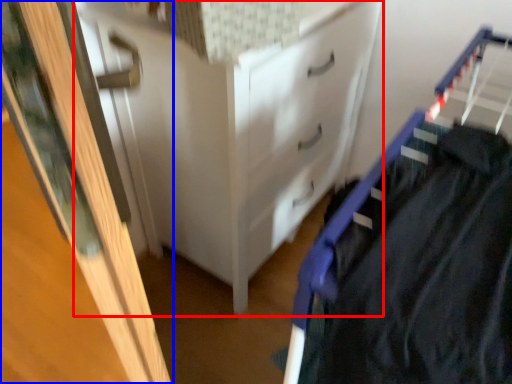
Question: Which object is further to the camera taking this photo, chest of drawers (highlighted by a red box) or door (highlighted by a blue box)?

Choices:
 (A) chest of drawers
 (B) door

Answer: (A)